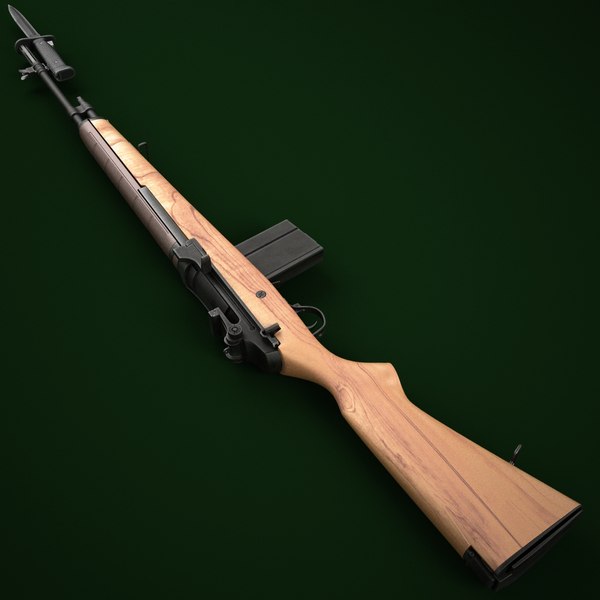
Locate an element on the screen. The image size is (600, 600). magazine is located at coordinates (271, 253).